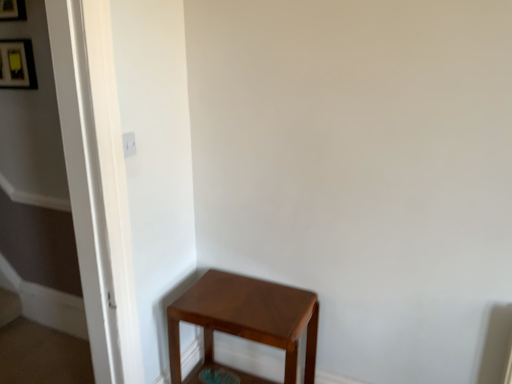
In order to click on matte black picture frame at upper left, positioned as the 2th picture frame in bottom-to-top order in this screenshot , I will do `click(12, 10)`.

The height and width of the screenshot is (384, 512). What do you see at coordinates (12, 10) in the screenshot?
I see `matte black picture frame at upper left, positioned as the 2th picture frame in bottom-to-top order` at bounding box center [12, 10].

The image size is (512, 384). What do you see at coordinates (17, 64) in the screenshot?
I see `matte black picture frame at upper left, marked as the first picture frame in a bottom-to-top arrangement` at bounding box center [17, 64].

Locate an element on the screen. matte black picture frame at upper left, positioned as the 2th picture frame in bottom-to-top order is located at coordinates (12, 10).

Looking at this image, from a real-world perspective, between matte black picture frame at upper left, positioned as the 2th picture frame in bottom-to-top order, and matte brown stool at lower right, who is vertically lower?

matte brown stool at lower right is physically lower.

Does point (12, 12) come farther from viewer compared to point (262, 314)?

Yes, point (12, 12) is behind point (262, 314).

Find the location of a particular element. Image resolution: width=512 pixels, height=384 pixels. stool in front of the matte black picture frame at upper left, the first picture frame positioned from the top is located at coordinates (246, 319).

Between matte black picture frame at upper left, arranged as the 2th picture frame when viewed from the top, and matte black picture frame at upper left, the first picture frame positioned from the top, which one has smaller size?

matte black picture frame at upper left, arranged as the 2th picture frame when viewed from the top.

Which of these two, matte black picture frame at upper left, marked as the first picture frame in a bottom-to-top arrangement, or matte black picture frame at upper left, the first picture frame positioned from the top, is thinner?

matte black picture frame at upper left, marked as the first picture frame in a bottom-to-top arrangement, is thinner.

Is matte black picture frame at upper left, marked as the first picture frame in a bottom-to-top arrangement, looking in the opposite direction of matte black picture frame at upper left, positioned as the 2th picture frame in bottom-to-top order?

No, matte black picture frame at upper left, marked as the first picture frame in a bottom-to-top arrangement,'s orientation is not away from matte black picture frame at upper left, positioned as the 2th picture frame in bottom-to-top order.

Considering the positions of point (13, 40) and point (1, 17), is point (13, 40) closer or farther from the camera than point (1, 17)?

Point (13, 40) is positioned farther from the camera compared to point (1, 17).

Based on the photo, is matte black picture frame at upper left, positioned as the 2th picture frame in bottom-to-top order, shorter than matte black picture frame at upper left, arranged as the 2th picture frame when viewed from the top?

Incorrect, the height of matte black picture frame at upper left, positioned as the 2th picture frame in bottom-to-top order, does not fall short of that of matte black picture frame at upper left, arranged as the 2th picture frame when viewed from the top.

Which is closer, (x=18, y=2) or (x=15, y=75)?

The point (x=18, y=2) is in front.

How much distance is there between matte black picture frame at upper left, the first picture frame positioned from the top, and matte black picture frame at upper left, marked as the first picture frame in a bottom-to-top arrangement?

A distance of 19.77 centimeters exists between matte black picture frame at upper left, the first picture frame positioned from the top, and matte black picture frame at upper left, marked as the first picture frame in a bottom-to-top arrangement.

I want to click on picture frame located behind the matte black picture frame at upper left, the first picture frame positioned from the top, so click(17, 64).

From the picture: Can you confirm if matte black picture frame at upper left, arranged as the 2th picture frame when viewed from the top, is wider than matte brown stool at lower right?

Incorrect, the width of matte black picture frame at upper left, arranged as the 2th picture frame when viewed from the top, does not surpass that of matte brown stool at lower right.

Who is shorter, matte black picture frame at upper left, marked as the first picture frame in a bottom-to-top arrangement, or matte brown stool at lower right?

matte black picture frame at upper left, marked as the first picture frame in a bottom-to-top arrangement.

Are matte black picture frame at upper left, marked as the first picture frame in a bottom-to-top arrangement, and matte brown stool at lower right beside each other?

matte black picture frame at upper left, marked as the first picture frame in a bottom-to-top arrangement, and matte brown stool at lower right are clearly separated.

Locate an element on the screen. The image size is (512, 384). stool below the matte black picture frame at upper left, marked as the first picture frame in a bottom-to-top arrangement (from a real-world perspective) is located at coordinates (246, 319).

Between point (307, 307) and point (24, 40), which one is positioned in front?

Positioned in front is point (307, 307).

How many degrees apart are the facing directions of matte brown stool at lower right and matte black picture frame at upper left, marked as the first picture frame in a bottom-to-top arrangement?

The angular difference between matte brown stool at lower right and matte black picture frame at upper left, marked as the first picture frame in a bottom-to-top arrangement, is 0.0154 degrees.

Choose the correct answer: Is matte brown stool at lower right inside matte black picture frame at upper left, arranged as the 2th picture frame when viewed from the top, or outside it?

matte brown stool at lower right is located beyond the bounds of matte black picture frame at upper left, arranged as the 2th picture frame when viewed from the top.

Could you tell me if matte brown stool at lower right is turned towards matte black picture frame at upper left, arranged as the 2th picture frame when viewed from the top?

No, matte brown stool at lower right is not facing towards matte black picture frame at upper left, arranged as the 2th picture frame when viewed from the top.

In terms of width, does matte brown stool at lower right look wider or thinner when compared to matte black picture frame at upper left, positioned as the 2th picture frame in bottom-to-top order?

In the image, matte brown stool at lower right appears to be wider than matte black picture frame at upper left, positioned as the 2th picture frame in bottom-to-top order.

Is matte black picture frame at upper left, the first picture frame positioned from the top, located within matte brown stool at lower right?

Definitely not — matte black picture frame at upper left, the first picture frame positioned from the top, is not inside matte brown stool at lower right.

From a real-world perspective, between matte brown stool at lower right and matte black picture frame at upper left, the first picture frame positioned from the top, who is vertically lower?

matte brown stool at lower right is physically lower.

Is matte brown stool at lower right positioned far away from matte black picture frame at upper left, the first picture frame positioned from the top?

matte brown stool at lower right is positioned a significant distance from matte black picture frame at upper left, the first picture frame positioned from the top.

Locate an element on the screen. stool in front of the matte black picture frame at upper left, the first picture frame positioned from the top is located at coordinates (246, 319).

Where is `picture frame below the matte black picture frame at upper left, the first picture frame positioned from the top (from the image's perspective)`? The image size is (512, 384). picture frame below the matte black picture frame at upper left, the first picture frame positioned from the top (from the image's perspective) is located at coordinates (17, 64).

Estimate the real-world distances between objects in this image. Which object is closer to matte black picture frame at upper left, positioned as the 2th picture frame in bottom-to-top order, matte brown stool at lower right or matte black picture frame at upper left, arranged as the 2th picture frame when viewed from the top?

matte black picture frame at upper left, arranged as the 2th picture frame when viewed from the top, is closer to matte black picture frame at upper left, positioned as the 2th picture frame in bottom-to-top order.

Estimate the real-world distances between objects in this image. Which object is closer to matte brown stool at lower right, matte black picture frame at upper left, marked as the first picture frame in a bottom-to-top arrangement, or matte black picture frame at upper left, positioned as the 2th picture frame in bottom-to-top order?

Among the two, matte black picture frame at upper left, marked as the first picture frame in a bottom-to-top arrangement, is located nearer to matte brown stool at lower right.

Estimate the real-world distances between objects in this image. Which object is further from matte black picture frame at upper left, positioned as the 2th picture frame in bottom-to-top order, matte black picture frame at upper left, marked as the first picture frame in a bottom-to-top arrangement, or matte brown stool at lower right?

Based on the image, matte brown stool at lower right appears to be further to matte black picture frame at upper left, positioned as the 2th picture frame in bottom-to-top order.

Which object lies further to the anchor point matte brown stool at lower right, matte black picture frame at upper left, the first picture frame positioned from the top, or matte black picture frame at upper left, marked as the first picture frame in a bottom-to-top arrangement?

matte black picture frame at upper left, the first picture frame positioned from the top, is further to matte brown stool at lower right.

Estimate the real-world distances between objects in this image. Which object is closer to matte black picture frame at upper left, marked as the first picture frame in a bottom-to-top arrangement, matte black picture frame at upper left, positioned as the 2th picture frame in bottom-to-top order, or matte brown stool at lower right?

The object closer to matte black picture frame at upper left, marked as the first picture frame in a bottom-to-top arrangement, is matte black picture frame at upper left, positioned as the 2th picture frame in bottom-to-top order.

Which object lies further to the anchor point matte black picture frame at upper left, marked as the first picture frame in a bottom-to-top arrangement, matte brown stool at lower right or matte black picture frame at upper left, the first picture frame positioned from the top?

matte brown stool at lower right is positioned further to the anchor matte black picture frame at upper left, marked as the first picture frame in a bottom-to-top arrangement.

Where is `picture frame between matte black picture frame at upper left, the first picture frame positioned from the top, and matte brown stool at lower right from top to bottom`? The width and height of the screenshot is (512, 384). picture frame between matte black picture frame at upper left, the first picture frame positioned from the top, and matte brown stool at lower right from top to bottom is located at coordinates (17, 64).